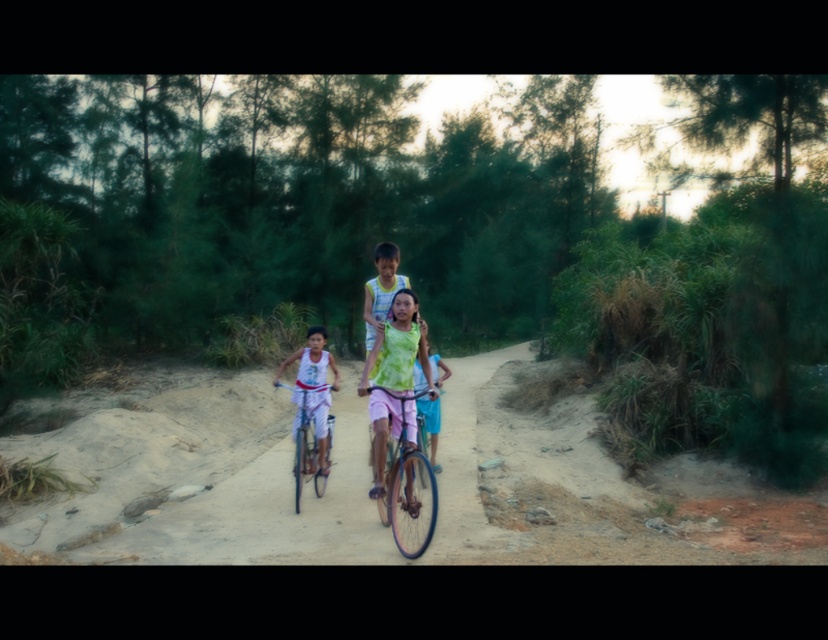
Question: Which object appears farthest from the camera in this image?

Choices:
 (A) metallic silver bicycle at center
 (B) light green tie-dye shirt at center
 (C) metallic blue bicycle at center
 (D) brown sandy dirt track at center

Answer: (A)

Question: Does light green tie-dye shirt at center have a smaller size compared to metallic blue bicycle at center?

Choices:
 (A) no
 (B) yes

Answer: (B)

Question: Considering the relative positions of brown sandy dirt track at center and metallic silver bicycle at center in the image provided, where is brown sandy dirt track at center located with respect to metallic silver bicycle at center?

Choices:
 (A) left
 (B) right

Answer: (B)

Question: Which point is farther to the camera?

Choices:
 (A) light green tie-dye shirt at center
 (B) metallic silver bicycle at center
 (C) metallic blue bicycle at center
 (D) brown sandy dirt track at center

Answer: (B)

Question: Which object appears closest to the camera in this image?

Choices:
 (A) brown sandy dirt track at center
 (B) light green tie-dye shirt at center
 (C) metallic blue bicycle at center
 (D) metallic silver bicycle at center

Answer: (C)

Question: Is metallic blue bicycle at center to the right of metallic silver bicycle at center from the viewer's perspective?

Choices:
 (A) yes
 (B) no

Answer: (A)